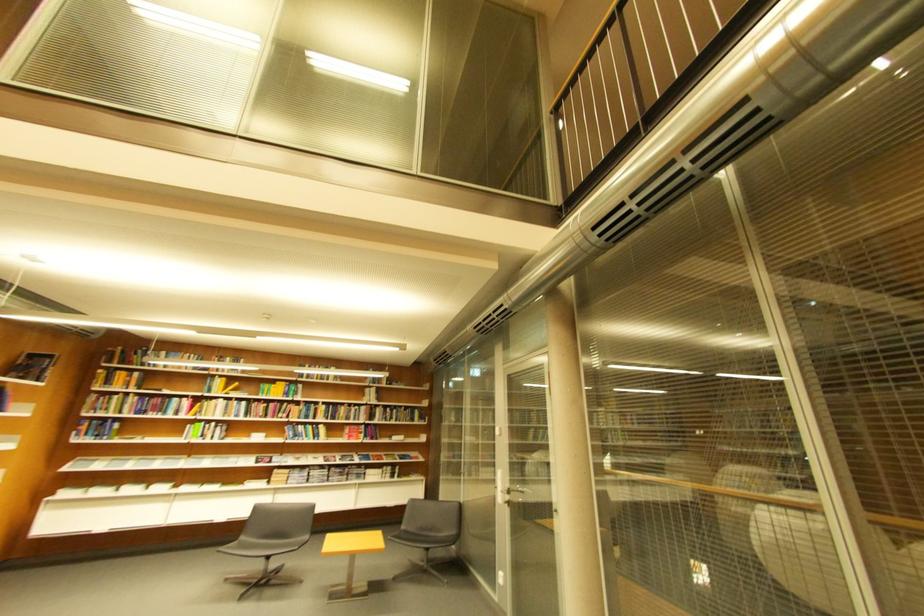
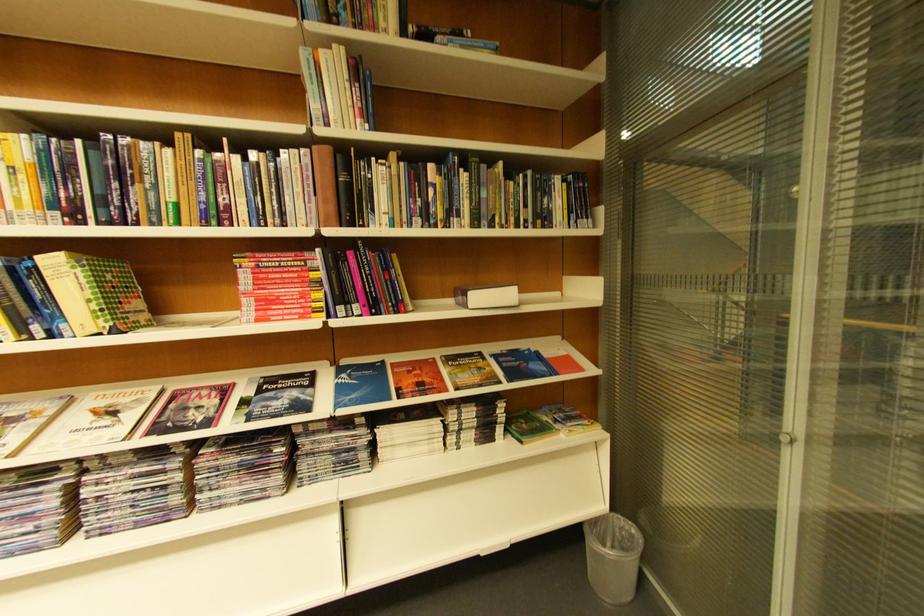
Where in the second image is the point corresponding to (x=382, y=391) from the first image?

(332, 55)